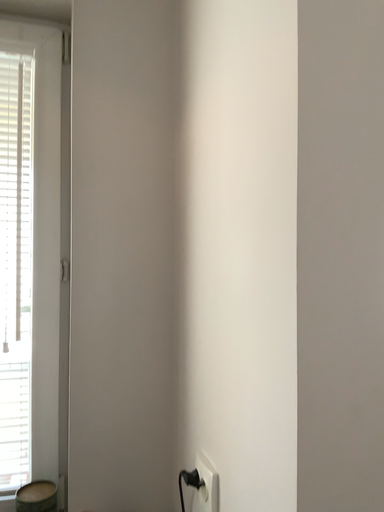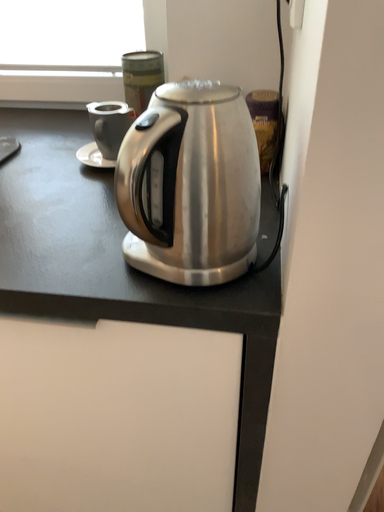
Question: Which way did the camera rotate in the video?

Choices:
 (A) rotated upward
 (B) rotated downward

Answer: (B)